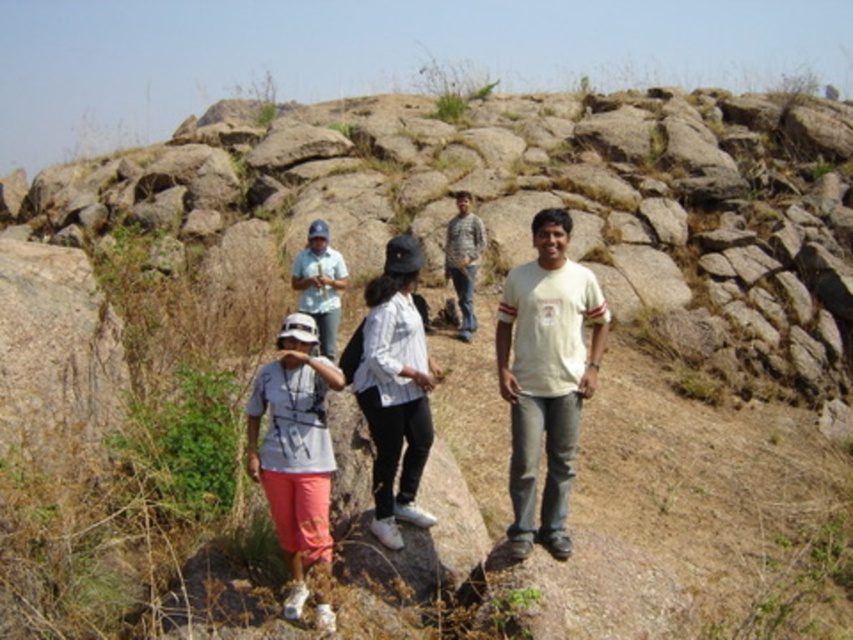
Question: Is white matte shirt at center bigger than camouflage fabric shirt at center?

Choices:
 (A) no
 (B) yes

Answer: (B)

Question: Which point is closer to the camera taking this photo?

Choices:
 (A) (335, 256)
 (B) (421, 444)
 (C) (468, 324)

Answer: (B)

Question: Among these points, which one is farthest from the camera?

Choices:
 (A) (416, 337)
 (B) (525, 305)

Answer: (A)

Question: Observing the image, what is the correct spatial positioning of matte white shirt at center in reference to camouflage fabric shirt at center?

Choices:
 (A) above
 (B) below

Answer: (B)

Question: Is the position of white matte shirt at center less distant than that of camouflage fabric shirt at center?

Choices:
 (A) no
 (B) yes

Answer: (B)

Question: Which point appears closest to the camera in this image?

Choices:
 (A) (469, 260)
 (B) (383, 424)
 (C) (573, 317)

Answer: (B)